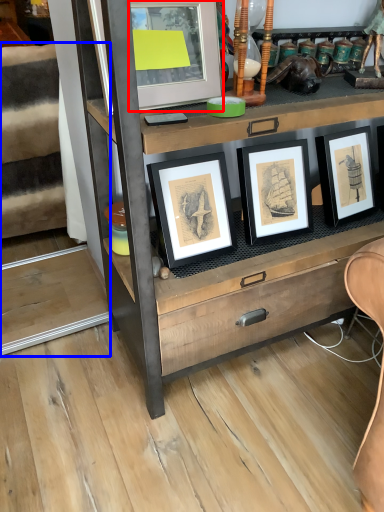
Question: Which object is closer to the camera taking this photo, picture frame (highlighted by a red box) or stairwell (highlighted by a blue box)?

Choices:
 (A) picture frame
 (B) stairwell

Answer: (A)